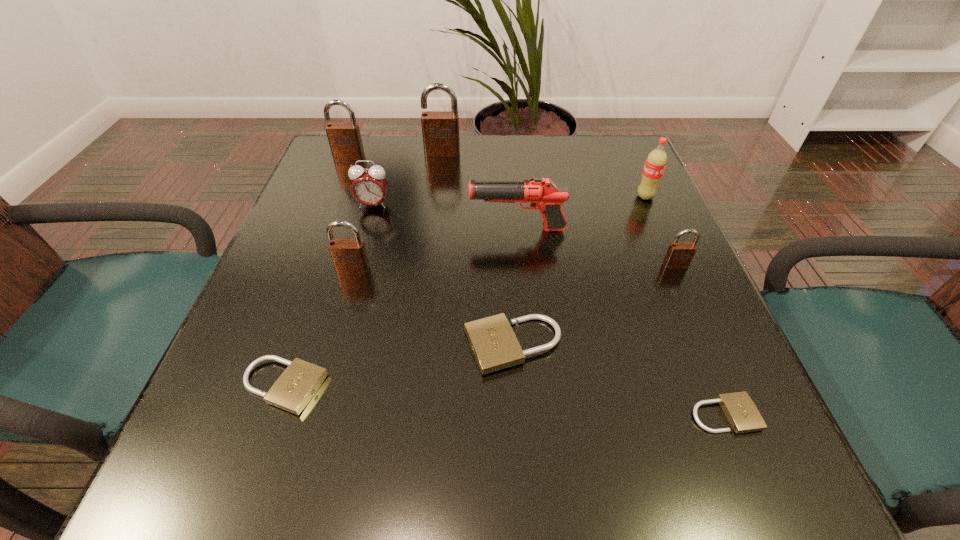
Find the location of a particular element. This screenshot has width=960, height=540. vacant space located on the left of the red soda is located at coordinates (579, 197).

Where is `vacant space located at the aiming end of the gun`? The width and height of the screenshot is (960, 540). vacant space located at the aiming end of the gun is located at coordinates (292, 230).

Identify the location of vacant space situated 0.090m at the aiming end of the gun. This screenshot has width=960, height=540. (426, 230).

Where is `free space located at the aiming end of the gun`? Image resolution: width=960 pixels, height=540 pixels. free space located at the aiming end of the gun is located at coordinates (297, 230).

In order to click on vacant region located 0.070m on the front-facing side of the third tallest padlock in this screenshot , I will do `click(345, 304)`.

I want to click on vacant space positioned on the clock face of the pink alarm clock, so click(354, 272).

This screenshot has height=540, width=960. In order to click on free spot located 0.120m on the front-facing side of the fourth tallest padlock in this screenshot , I will do `click(698, 319)`.

The width and height of the screenshot is (960, 540). In order to click on blank area located 0.200m on the left of the biggest beige padlock in this screenshot , I will do `click(341, 345)`.

The height and width of the screenshot is (540, 960). What are the coordinates of `free space located on the right of the second shortest object` in the screenshot? It's located at (445, 386).

Identify the location of free space located 0.270m on the left of the smallest beige padlock. The height and width of the screenshot is (540, 960). (503, 414).